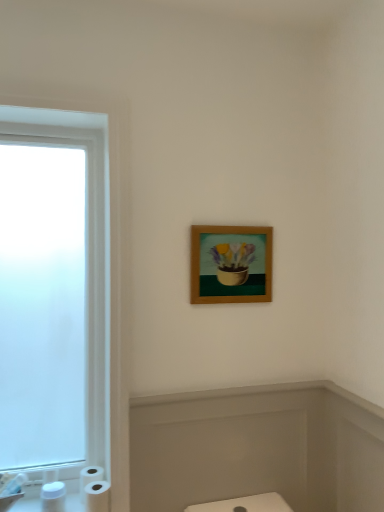
Question: Is white matte toilet paper at lower left taller or shorter than white glossy sink at lower left?

Choices:
 (A) tall
 (B) short

Answer: (A)

Question: From a real-world perspective, is white matte toilet paper at lower left above or below white glossy sink at lower left?

Choices:
 (A) above
 (B) below

Answer: (B)

Question: Which is nearer to the matte white bathtub at lower center?

Choices:
 (A) wooden frame at upper center
 (B) white matte toilet paper at lower left
 (C) white matte toilet paper at lower left
 (D) white glossy sink at lower left

Answer: (A)

Question: Estimate the real-world distances between objects in this image. Which object is farther from the white matte toilet paper at lower left?

Choices:
 (A) wooden frame at upper center
 (B) white glossy sink at lower left
 (C) white matte toilet paper at lower left
 (D) matte white bathtub at lower center

Answer: (A)